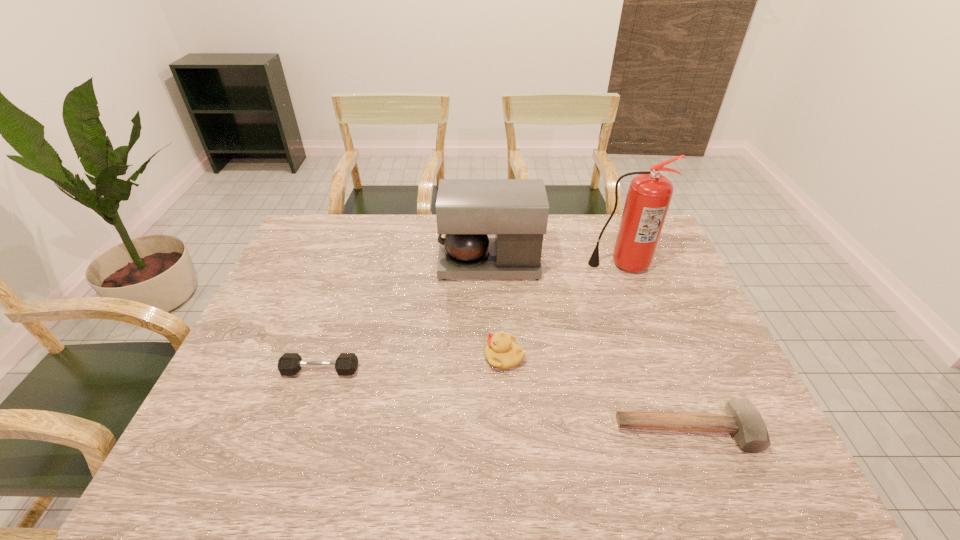
You are a GUI agent. You are given a task and a screenshot of the screen. Output one action in this format:
    pyautogui.click(x=<x>, y=<y>)
    Task: Click on the object that is positioned at the far right corner
    
    Given the screenshot: What is the action you would take?
    pyautogui.click(x=649, y=195)

Locate an element on the screen. This screenshot has height=540, width=960. object at the near right corner is located at coordinates (742, 419).

The height and width of the screenshot is (540, 960). Identify the location of free region at the far edge of the desktop. (594, 248).

The height and width of the screenshot is (540, 960). What are the coordinates of `free space at the near edge` in the screenshot? It's located at (372, 463).

In the image, there is a desktop. Where is `vacant space at the left edge`? This screenshot has height=540, width=960. vacant space at the left edge is located at coordinates (309, 265).

Where is `vacant area at the right edge of the desktop`? The height and width of the screenshot is (540, 960). vacant area at the right edge of the desktop is located at coordinates (657, 260).

Image resolution: width=960 pixels, height=540 pixels. In order to click on vacant space at the far left corner of the desktop in this screenshot , I will do pyautogui.click(x=312, y=253).

The image size is (960, 540). I want to click on vacant area at the near left corner of the desktop, so click(x=227, y=454).

Where is `unoccupied area between the duckling and the leftmost object`? unoccupied area between the duckling and the leftmost object is located at coordinates (413, 364).

Identify the location of vacant area that lies between the nearest object and the fire extinguisher. (654, 347).